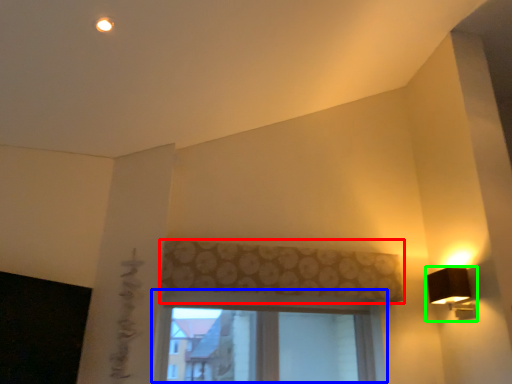
Question: Which object is the closest to the curtain (highlighted by a red box)? Choose among these: window (highlighted by a blue box) or lamp (highlighted by a green box).

Choices:
 (A) window
 (B) lamp

Answer: (A)